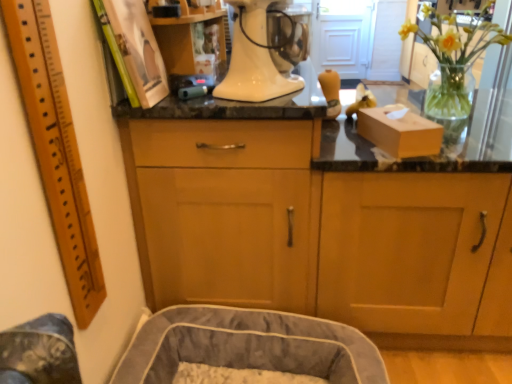
You are a GUI agent. You are given a task and a screenshot of the screen. Output one action in this format:
    pyautogui.click(x=<x>, y=<y>)
    Task: Click on the free point to the left of matte cardboard box at right
    The width and height of the screenshot is (512, 384).
    Given the screenshot: What is the action you would take?
    pyautogui.click(x=360, y=150)